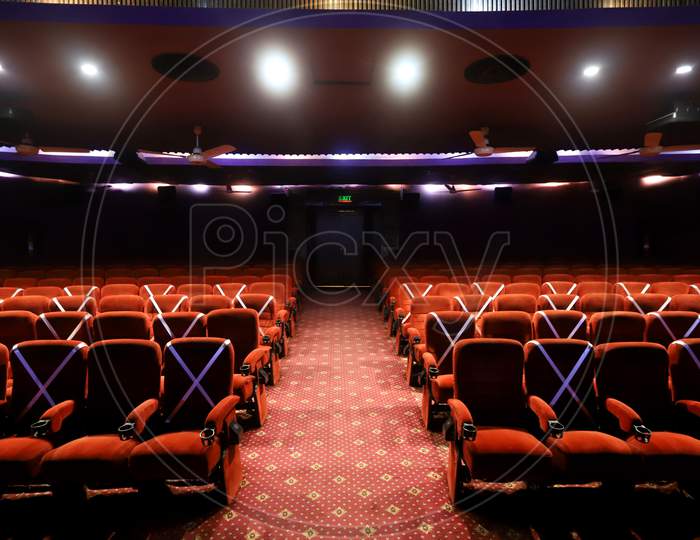
Identify the location of ceiling fans. (24, 148), (197, 148), (482, 147), (648, 141), (458, 189), (228, 192).